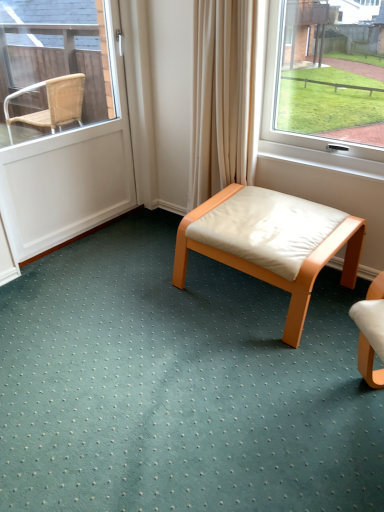
What are the coordinates of `vacant area that lies between light brown wood stool at center and white matte door at left` in the screenshot? It's located at (144, 264).